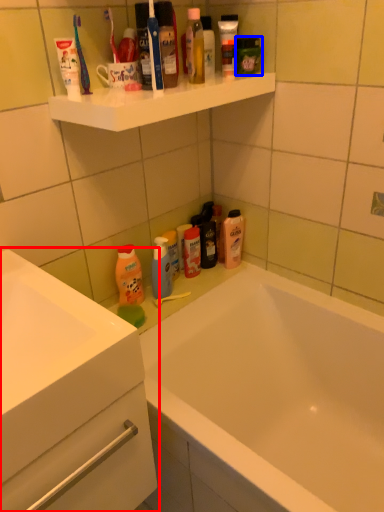
Question: Which of the following is the closest to the observer, bathroom cabinet (highlighted by a red box) or toiletry (highlighted by a blue box)?

Choices:
 (A) bathroom cabinet
 (B) toiletry

Answer: (A)